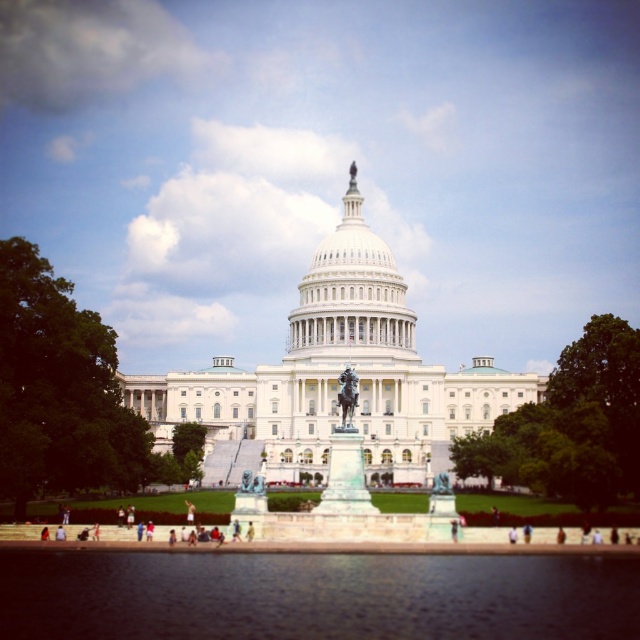
You are standing in front of the United States Capitol Building and notice both the white marble dome at center and the light brown leather jacket at center. Which object is closer to you?

The white marble dome at center is closer to you because it is further to the viewer than the light brown leather jacket at center.

You are standing in front of the United States Capitol Building and notice a green leafy tree at center and a light brown leather jacket at center. Which object is wider?

The green leafy tree at center might be wider than the light brown leather jacket at center.